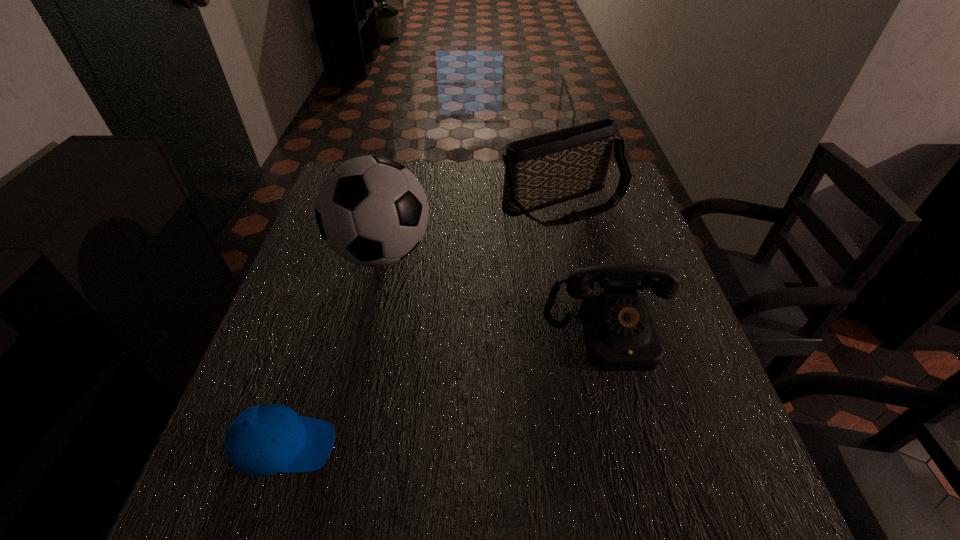
Where is `free area in between the tallest object and the nearest object`? The height and width of the screenshot is (540, 960). free area in between the tallest object and the nearest object is located at coordinates (333, 349).

Locate an element on the screen. This screenshot has height=540, width=960. empty location between the handbag and the nearest object is located at coordinates (424, 325).

Image resolution: width=960 pixels, height=540 pixels. Find the location of `the closest object to the cap`. the closest object to the cap is located at coordinates (372, 211).

Point out which object is positioned as the third nearest to the handbag. Please provide its 2D coordinates. Your answer should be formatted as a tuple, i.e. [(x, y)], where the tuple contains the x and y coordinates of a point satisfying the conditions above.

[(262, 440)]

Locate an element on the screen. The width and height of the screenshot is (960, 540). free space that satisfies the following two spatial constraints: 1. on the front side of the tallest object; 2. on the front-facing side of the nearest object is located at coordinates (337, 446).

Locate an element on the screen. Image resolution: width=960 pixels, height=540 pixels. vacant area in the image that satisfies the following two spatial constraints: 1. on the front side of the soccer ball; 2. on the front-facing side of the cap is located at coordinates (337, 446).